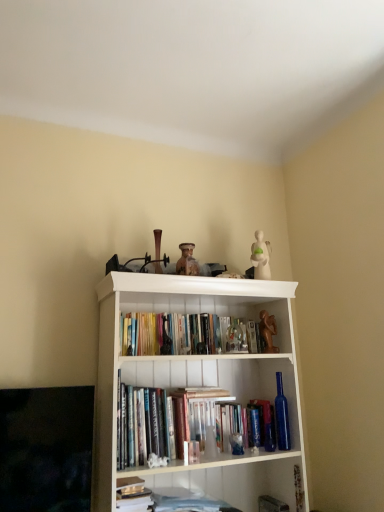
Question: From the image's perspective, would you say white paper stack at lower center, which is the first book in bottom-to-top order, is shown under brown matte statue at upper center?

Choices:
 (A) yes
 (B) no

Answer: (A)

Question: Is white paper stack at lower center, the third book viewed from the top, shorter than brown matte statue at upper center?

Choices:
 (A) yes
 (B) no

Answer: (A)

Question: Is white paper stack at lower center, which is the first book in bottom-to-top order, behind brown matte statue at upper center?

Choices:
 (A) yes
 (B) no

Answer: (B)

Question: Is white paper stack at lower center, which is the first book in bottom-to-top order, facing towards brown matte statue at upper center?

Choices:
 (A) no
 (B) yes

Answer: (A)

Question: Can you confirm if white paper stack at lower center, which is the first book in bottom-to-top order, is positioned to the left of brown matte statue at upper center?

Choices:
 (A) no
 (B) yes

Answer: (B)

Question: From a real-world perspective, relative to white matte bookcase at center, is hardcover book at center vertically above or below?

Choices:
 (A) above
 (B) below

Answer: (B)

Question: From the image's perspective, is hardcover book at center located above or below white matte bookcase at center?

Choices:
 (A) below
 (B) above

Answer: (A)

Question: Is hardcover book at center spatially inside white matte bookcase at center, or outside of it?

Choices:
 (A) inside
 (B) outside

Answer: (A)

Question: Would you say hardcover book at center is to the left or to the right of white matte bookcase at center in the picture?

Choices:
 (A) right
 (B) left

Answer: (A)

Question: From the image's perspective, is hardcover book at lower center, the second book positioned from the top, located above or below white paper stack at lower center, which is the first book in bottom-to-top order?

Choices:
 (A) below
 (B) above

Answer: (B)

Question: In terms of height, does hardcover book at lower center, the second book positioned from the top, look taller or shorter compared to white paper stack at lower center, which is the first book in bottom-to-top order?

Choices:
 (A) short
 (B) tall

Answer: (B)

Question: Considering their positions, is hardcover book at lower center, the second book positioned from the top, located in front of or behind white paper stack at lower center, the third book viewed from the top?

Choices:
 (A) behind
 (B) front

Answer: (B)

Question: Looking at the image, does hardcover book at lower center, the 2th book positioned from the bottom, seem bigger or smaller compared to white paper stack at lower center, which is the first book in bottom-to-top order?

Choices:
 (A) big
 (B) small

Answer: (B)

Question: Looking at their shapes, would you say hardcover book at lower center, the 2th book positioned from the bottom, is wider or thinner than hardcover books at center, placed as the 1th book when sorted from top to bottom?

Choices:
 (A) wide
 (B) thin

Answer: (A)

Question: Is hardcover book at lower center, the 2th book positioned from the bottom, bigger or smaller than hardcover books at center, which appears as the 3th book when ordered from the bottom?

Choices:
 (A) small
 (B) big

Answer: (A)